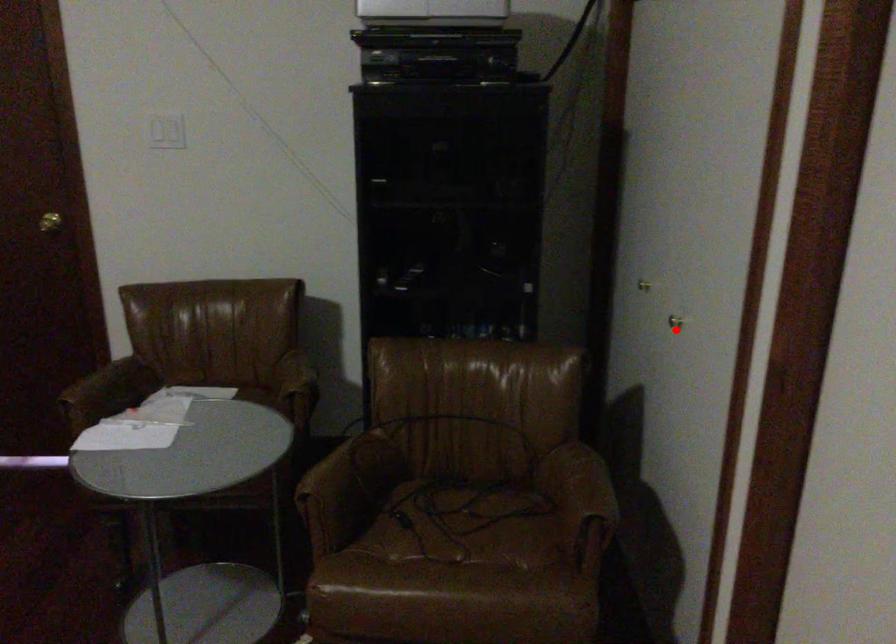
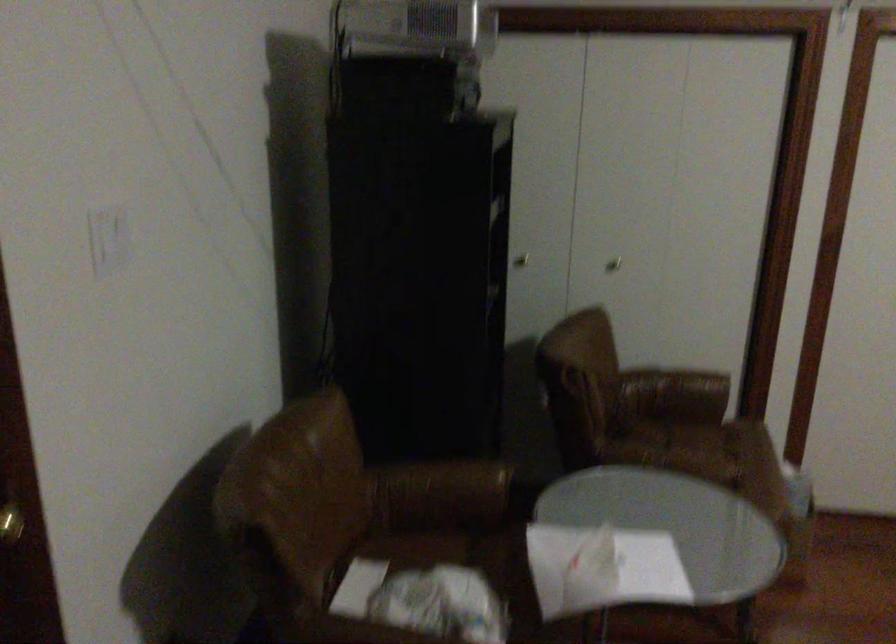
The point at the highlighted location is marked in the first image. Where is the corresponding point in the second image?

(613, 263)